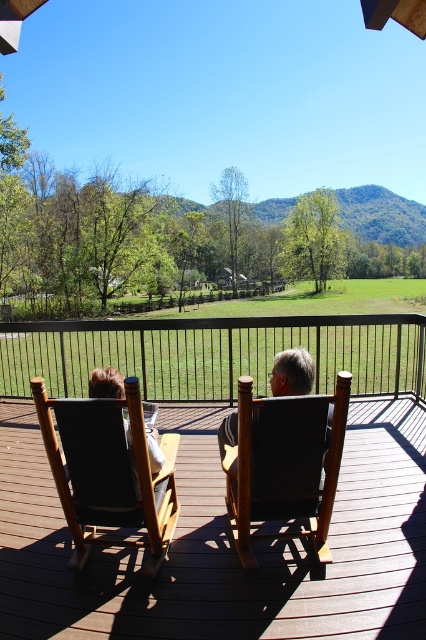
Is the position of black fabric chair at center more distant than that of dark gray fabric chair at center?

No, it is not.

Looking at this image, is black fabric chair at center taller than dark gray fabric chair at center?

Indeed, black fabric chair at center has a greater height compared to dark gray fabric chair at center.

Looking at this image, measure the distance between point (x=261, y=458) and camera.

Point (x=261, y=458) and camera are 6.85 feet apart from each other.

Where is `black fabric chair at center`? Image resolution: width=426 pixels, height=640 pixels. black fabric chair at center is located at coordinates (284, 465).

Who is positioned more to the right, green grassy field at center or black fabric chair at center?

From the viewer's perspective, green grassy field at center appears more on the right side.

The image size is (426, 640). I want to click on green grassy field at center, so click(x=230, y=346).

Does black fabric chair at center have a lesser width compared to brown leather chair at center?

No.

The image size is (426, 640). What do you see at coordinates (284, 465) in the screenshot?
I see `black fabric chair at center` at bounding box center [284, 465].

Between point (273, 492) and point (101, 371), which one is positioned behind?

The point (101, 371) is more distant.

You are a GUI agent. You are given a task and a screenshot of the screen. Output one action in this format:
    pyautogui.click(x=<x>, y=<y>)
    Task: Click on the black fabric chair at center
    The width and height of the screenshot is (426, 640).
    Given the screenshot: What is the action you would take?
    pyautogui.click(x=284, y=465)